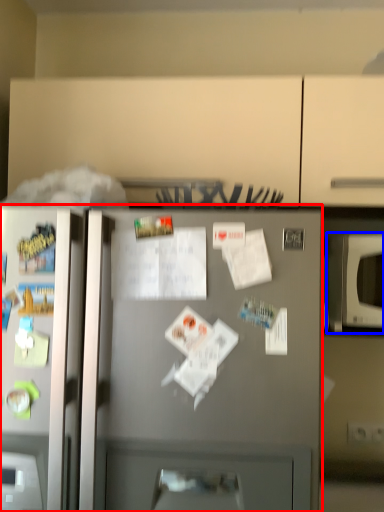
Question: Among these objects, which one is nearest to the camera, refrigerator (highlighted by a red box) or microwave oven (highlighted by a blue box)?

Choices:
 (A) refrigerator
 (B) microwave oven

Answer: (A)